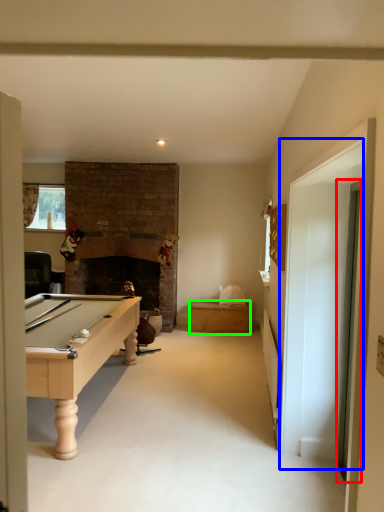
Question: Which is nearer to the glass door (highlighted by a red box)? glass door (highlighted by a blue box) or drawer (highlighted by a green box).

Choices:
 (A) glass door
 (B) drawer

Answer: (A)